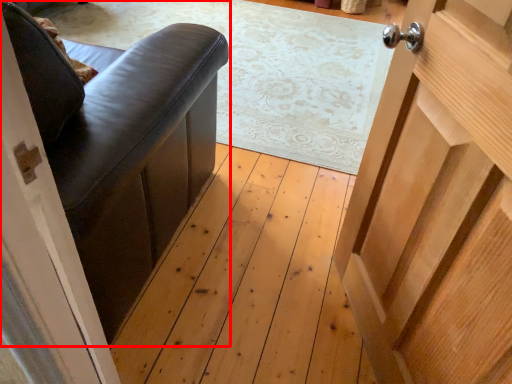
Question: From the image's perspective, considering the relative positions of furniture (annotated by the red box) and door in the image provided, where is furniture (annotated by the red box) located with respect to the staircase?

Choices:
 (A) below
 (B) above

Answer: (B)